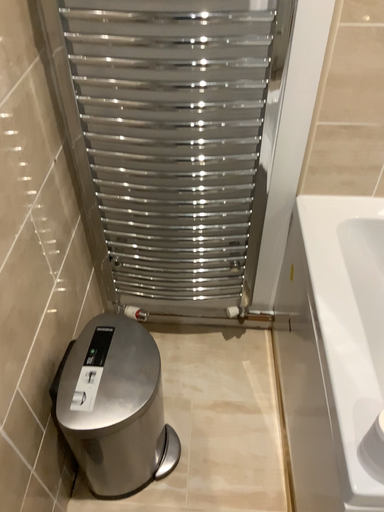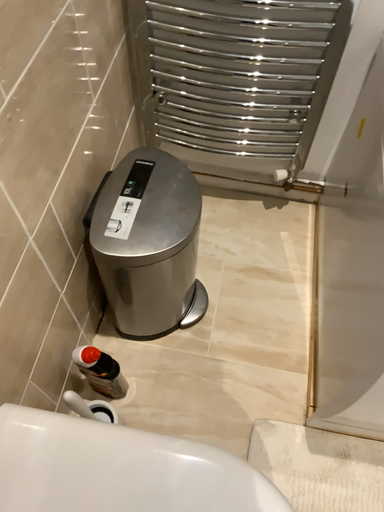
Question: How did the camera likely rotate when shooting the video?

Choices:
 (A) rotated downward
 (B) rotated upward

Answer: (A)